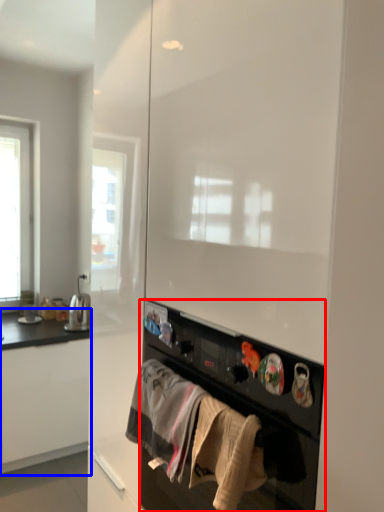
Question: Which of the following is the farthest to the observer, home appliance (highlighted by a red box) or cabinetry (highlighted by a blue box)?

Choices:
 (A) home appliance
 (B) cabinetry

Answer: (B)